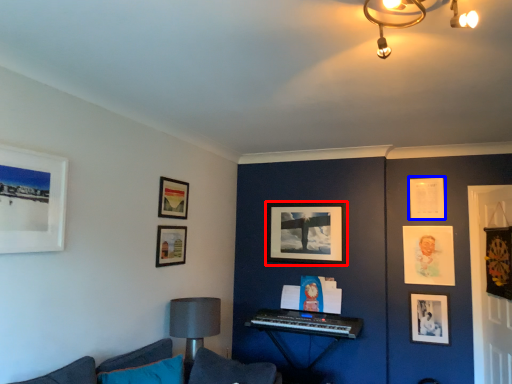
Question: Which object appears closest to the camera in this image, picture frame (highlighted by a red box) or picture frame (highlighted by a blue box)?

Choices:
 (A) picture frame
 (B) picture frame

Answer: (B)